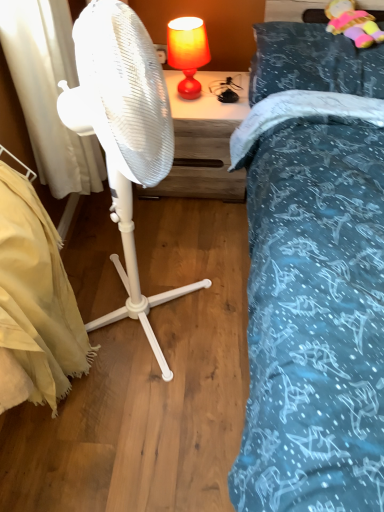
Question: Considering the positions of white fabric curtain at left and beige fabric mattress at lower left in the image, is white fabric curtain at left wider or thinner than beige fabric mattress at lower left?

Choices:
 (A) wide
 (B) thin

Answer: (B)

Question: In terms of size, does white fabric curtain at left appear bigger or smaller than beige fabric mattress at lower left?

Choices:
 (A) small
 (B) big

Answer: (A)

Question: Considering the real-world distances, which object is farthest from the teal fabric pillow at upper right?

Choices:
 (A) fluffy plush toy at upper right
 (B) beige fabric mattress at lower left
 (C) white plastic fan at center
 (D) white fabric curtain at left
 (E) wooden nightstand at center

Answer: (B)

Question: Estimate the real-world distances between objects in this image. Which object is closer to the white plastic fan at center?

Choices:
 (A) teal fabric pillow at upper right
 (B) white fabric curtain at left
 (C) matte orange lampshade at upper center
 (D) wooden nightstand at center
 (E) beige fabric mattress at lower left

Answer: (E)